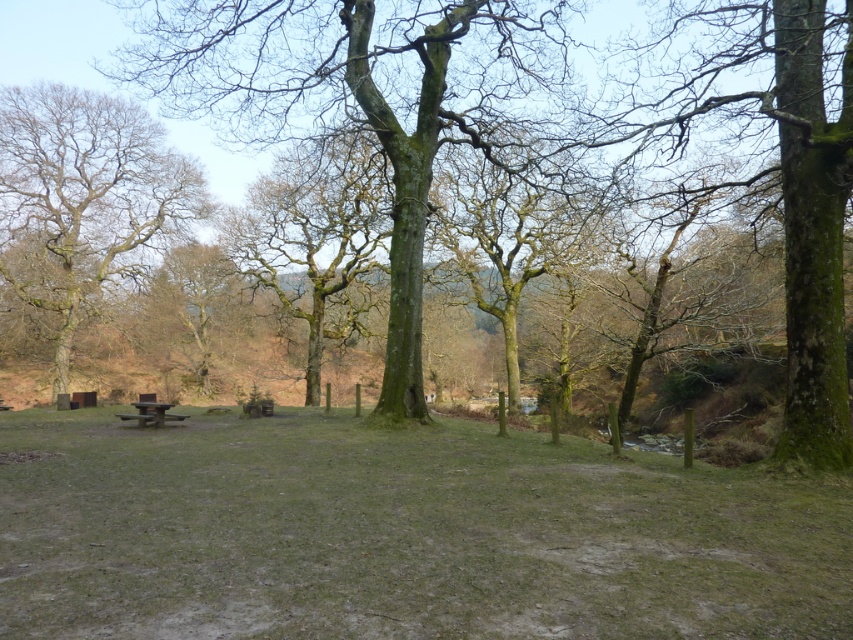
You are standing in the park and want to take a photo of the green mossy tree at left and the wooden picnic table at lower left. Which object should you focus on first to ensure both are in the frame?

You should focus on the green mossy tree at left first because it is closer to you than the wooden picnic table at lower left, so adjusting the camera to include it will also capture the farther picnic table.

You are planning to set up a tent in the green grassy field at center. To ensure there is enough space, you need to know if the field is wider than the wooden picnic table at lower left. Can you confirm this?

The green grassy field at center might be wider than the wooden picnic table at lower left, so there is a possibility that the field is wide enough for the tent, but the exact width isn

You are standing in the park and want to walk from the point at coordinates point (560, 516) to the point at coordinates point (64, 92). Which direction should you head?

Since point (560, 516) is closer to you than point (64, 92), you should move away from your current position towards the point (64, 92).